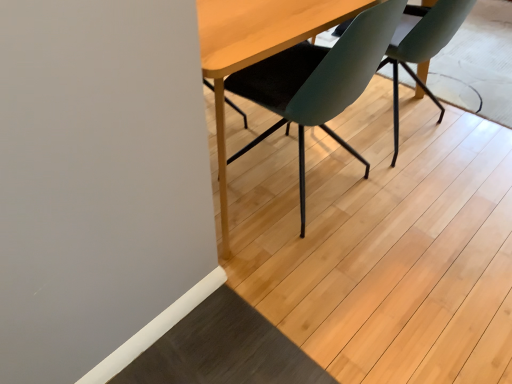
Question: Would you say teal matte chair at center, the second chair when ordered from left to right, is inside or outside matte black chair at center, which is the second chair from right to left?

Choices:
 (A) outside
 (B) inside

Answer: (A)

Question: Visually, is teal matte chair at center, which is the 1th chair from right to left, positioned to the left or to the right of matte black chair at center, which is the second chair from right to left?

Choices:
 (A) right
 (B) left

Answer: (A)

Question: Is point (394, 49) closer or farther from the camera than point (361, 8)?

Choices:
 (A) closer
 (B) farther

Answer: (B)

Question: Considering the relative positions of matte black chair at center, which is the first chair in left-to-right order, and teal matte chair at center, the second chair when ordered from left to right, in the image provided, is matte black chair at center, which is the first chair in left-to-right order, to the left or to the right of teal matte chair at center, the second chair when ordered from left to right,?

Choices:
 (A) right
 (B) left

Answer: (B)

Question: Is matte black chair at center, which is the first chair in left-to-right order, inside or outside of teal matte chair at center, the second chair when ordered from left to right?

Choices:
 (A) outside
 (B) inside

Answer: (A)

Question: Considering their positions, is matte black chair at center, which is the first chair in left-to-right order, located in front of or behind teal matte chair at center, which is the 1th chair from right to left?

Choices:
 (A) front
 (B) behind

Answer: (A)

Question: From the image's perspective, relative to teal matte chair at center, the second chair when ordered from left to right, is matte black chair at center, which is the first chair in left-to-right order, above or below?

Choices:
 (A) above
 (B) below

Answer: (B)